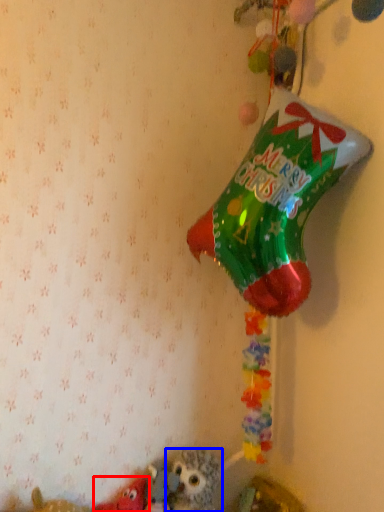
Question: Which object appears farthest to the camera in this image, toy (highlighted by a red box) or toy (highlighted by a blue box)?

Choices:
 (A) toy
 (B) toy

Answer: (B)